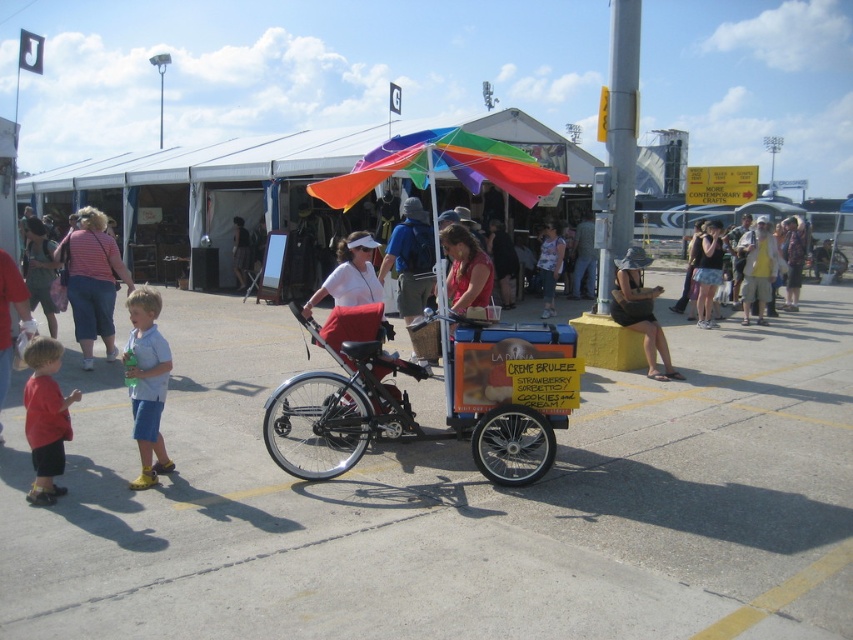
You are a customer at the fair and want to buy the matte red shorts at lower left. Where exactly should you look to find them?

The matte red shorts at lower left are located at point (45, 419).

You are a customer at the fair and want to buy a pair of denim shorts. You see two options available on the cart operated by the woman in red. The items are the light blue denim shorts at lower left and the blue denim shorts at center. Which one is wider?

The blue denim shorts at center are wider than the light blue denim shorts at lower left.